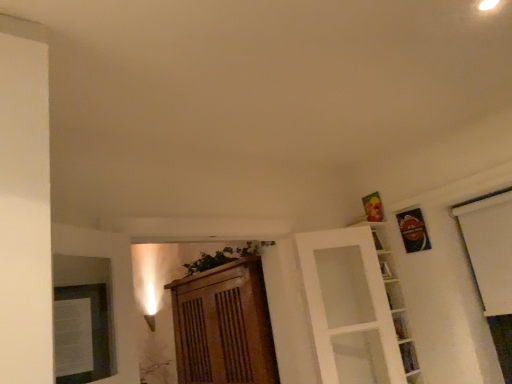
Find the location of a particular element. The image size is (512, 384). wooden cabinet at center is located at coordinates (223, 326).

Describe the element at coordinates (223, 326) in the screenshot. The image size is (512, 384). I see `wooden cabinet at center` at that location.

This screenshot has width=512, height=384. I want to click on wooden cabinet at center, so click(223, 326).

Where is `door in front of the wooden cabinet at center`? door in front of the wooden cabinet at center is located at coordinates (349, 307).

Which is in front, point (217, 270) or point (314, 259)?

Point (314, 259)

From the picture: Can you confirm if wooden cabinet at center is bigger than white glass door at upper right?

Yes.

From a real-world perspective, is wooden cabinet at center positioned above or below white glass door at upper right?

wooden cabinet at center is below white glass door at upper right.

From the image's perspective, between clear glass shelf at lower right, the first shelf when ordered from bottom to top, and white glass shelves at upper right, placed as the 1th shelf when sorted from top to bottom, which one is located above?

white glass shelves at upper right, placed as the 1th shelf when sorted from top to bottom, from the image's perspective.

Is clear glass shelf at lower right, which is counted as the second shelf, starting from the top, facing away from white glass shelves at upper right, which is the second shelf in bottom-to-top order?

Absolutely, clear glass shelf at lower right, which is counted as the second shelf, starting from the top, is directed away from white glass shelves at upper right, which is the second shelf in bottom-to-top order.

Between clear glass shelf at lower right, the first shelf when ordered from bottom to top, and white glass shelves at upper right, which is the second shelf in bottom-to-top order, which one has less height?

With less height is clear glass shelf at lower right, the first shelf when ordered from bottom to top.

Which is closer to the camera, (x=412, y=364) or (x=404, y=351)?

The point (x=404, y=351) is in front.

Is clear glass shelf at lower right, which is counted as the second shelf, starting from the top, a part of wooden cabinet at center?

No, clear glass shelf at lower right, which is counted as the second shelf, starting from the top, is located outside of wooden cabinet at center.

From the image's perspective, who appears lower, wooden cabinet at center or clear glass shelf at lower right, the first shelf when ordered from bottom to top?

wooden cabinet at center, from the image's perspective.

There is a wooden cabinet at center. Where is `the 1st shelf above it (from the image's perspective)`? the 1st shelf above it (from the image's perspective) is located at coordinates (409, 357).

This screenshot has height=384, width=512. There is a clear glass shelf at lower right, the first shelf when ordered from bottom to top. Find the location of `cabinetry above it (from a real-world perspective)`. cabinetry above it (from a real-world perspective) is located at coordinates (223, 326).

Consider the image. From a real-world perspective, which object stands above the other?

wooden cabinet at center, from a real-world perspective.

Choose the correct answer: Is clear glass shelf at lower right, which is counted as the second shelf, starting from the top, inside wooden cabinet at center or outside it?

clear glass shelf at lower right, which is counted as the second shelf, starting from the top, is located beyond the bounds of wooden cabinet at center.

Is point (415, 352) positioned in front of point (241, 327)?

Yes, point (415, 352) is closer to viewer.

Which is behind, white glass shelves at upper right, placed as the 1th shelf when sorted from top to bottom, or white glass door at upper right?

white glass shelves at upper right, placed as the 1th shelf when sorted from top to bottom, is further from the camera.

Is point (382, 238) positioned after point (351, 353)?

Yes, point (382, 238) is farther from viewer.

You are a GUI agent. You are given a task and a screenshot of the screen. Output one action in this format:
    pyautogui.click(x=<x>, y=<y>)
    Task: Click on the 1st shelf to the right of the white glass door at upper right, starting your count from the anchor
    The image size is (512, 384).
    Given the screenshot: What is the action you would take?
    pyautogui.click(x=395, y=301)

Is white glass door at upper right facing towards clear glass shelf at lower right, which is counted as the second shelf, starting from the top?

No, white glass door at upper right is not facing towards clear glass shelf at lower right, which is counted as the second shelf, starting from the top.

Can you confirm if white glass door at upper right is wider than clear glass shelf at lower right, the first shelf when ordered from bottom to top?

Yes, white glass door at upper right is wider than clear glass shelf at lower right, the first shelf when ordered from bottom to top.

Considering the relative sizes of white glass door at upper right and clear glass shelf at lower right, the first shelf when ordered from bottom to top, in the image provided, is white glass door at upper right bigger than clear glass shelf at lower right, the first shelf when ordered from bottom to top,?

Correct, white glass door at upper right is larger in size than clear glass shelf at lower right, the first shelf when ordered from bottom to top.

Is point (370, 302) in front of point (406, 342)?

No, (370, 302) is further to viewer.

Measure the distance between white glass door at upper right and white glass shelves at upper right, which is the second shelf in bottom-to-top order.

The distance of white glass door at upper right from white glass shelves at upper right, which is the second shelf in bottom-to-top order, is 8.54 inches.

Is the depth of white glass door at upper right greater than that of white glass shelves at upper right, which is the second shelf in bottom-to-top order?

No, white glass door at upper right is closer to the camera.

Is white glass door at upper right next to white glass shelves at upper right, placed as the 1th shelf when sorted from top to bottom, and touching it?

There is a gap between white glass door at upper right and white glass shelves at upper right, placed as the 1th shelf when sorted from top to bottom.

Considering the sizes of objects white glass door at upper right and white glass shelves at upper right, placed as the 1th shelf when sorted from top to bottom, in the image provided, who is bigger, white glass door at upper right or white glass shelves at upper right, placed as the 1th shelf when sorted from top to bottom,?

white glass door at upper right.

Locate an element on the screen. Image resolution: width=512 pixels, height=384 pixels. cabinetry that appears on the left of white glass door at upper right is located at coordinates (223, 326).

Find the location of a particular element. The height and width of the screenshot is (384, 512). shelf located underneath the white glass shelves at upper right, placed as the 1th shelf when sorted from top to bottom (from a real-world perspective) is located at coordinates (409, 357).

Looking at the image, which one is located closer to white glass shelves at upper right, which is the second shelf in bottom-to-top order, clear glass shelf at lower right, which is counted as the second shelf, starting from the top, or wooden cabinet at center?

The object closer to white glass shelves at upper right, which is the second shelf in bottom-to-top order, is clear glass shelf at lower right, which is counted as the second shelf, starting from the top.

From the image, which object appears to be nearer to white glass shelves at upper right, which is the second shelf in bottom-to-top order, white glass door at upper right or clear glass shelf at lower right, the first shelf when ordered from bottom to top?

clear glass shelf at lower right, the first shelf when ordered from bottom to top, is closer to white glass shelves at upper right, which is the second shelf in bottom-to-top order.

Considering their positions, is white glass door at upper right positioned closer to wooden cabinet at center than clear glass shelf at lower right, the first shelf when ordered from bottom to top?

Based on the image, white glass door at upper right appears to be nearer to wooden cabinet at center.

Considering their positions, is white glass shelves at upper right, placed as the 1th shelf when sorted from top to bottom, positioned further to white glass door at upper right than clear glass shelf at lower right, which is counted as the second shelf, starting from the top?

clear glass shelf at lower right, which is counted as the second shelf, starting from the top, is further to white glass door at upper right.

When comparing their distances from white glass door at upper right, does clear glass shelf at lower right, which is counted as the second shelf, starting from the top, or white glass shelves at upper right, placed as the 1th shelf when sorted from top to bottom, seem further?

The object further to white glass door at upper right is clear glass shelf at lower right, which is counted as the second shelf, starting from the top.

Estimate the real-world distances between objects in this image. Which object is further from wooden cabinet at center, white glass shelves at upper right, which is the second shelf in bottom-to-top order, or white glass door at upper right?

white glass shelves at upper right, which is the second shelf in bottom-to-top order, is further to wooden cabinet at center.

Estimate the real-world distances between objects in this image. Which object is closer to white glass shelves at upper right, placed as the 1th shelf when sorted from top to bottom, white glass door at upper right or wooden cabinet at center?

white glass door at upper right is closer to white glass shelves at upper right, placed as the 1th shelf when sorted from top to bottom.

Which object lies further to the anchor point clear glass shelf at lower right, the first shelf when ordered from bottom to top, wooden cabinet at center or white glass door at upper right?

The object further to clear glass shelf at lower right, the first shelf when ordered from bottom to top, is wooden cabinet at center.

Identify the location of door between wooden cabinet at center and clear glass shelf at lower right, the first shelf when ordered from bottom to top. Image resolution: width=512 pixels, height=384 pixels. (349, 307).

Where is `shelf between wooden cabinet at center and clear glass shelf at lower right, which is counted as the second shelf, starting from the top`? shelf between wooden cabinet at center and clear glass shelf at lower right, which is counted as the second shelf, starting from the top is located at coordinates (395, 301).

Image resolution: width=512 pixels, height=384 pixels. Identify the location of door located between wooden cabinet at center and white glass shelves at upper right, placed as the 1th shelf when sorted from top to bottom, in the left-right direction. (349, 307).

The height and width of the screenshot is (384, 512). What are the coordinates of `shelf between white glass door at upper right and clear glass shelf at lower right, which is counted as the second shelf, starting from the top, from top to bottom` in the screenshot? It's located at (395, 301).